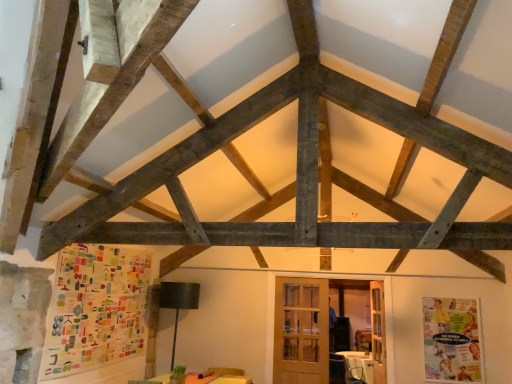
Image resolution: width=512 pixels, height=384 pixels. Describe the element at coordinates (178, 303) in the screenshot. I see `black fabric lamp at lower left` at that location.

I want to click on black fabric lamp at lower left, so click(x=178, y=303).

What is the approximate height of black fabric lamp at lower left?

1.26 meters.

Find the location of a particular element. The height and width of the screenshot is (384, 512). black fabric lamp at lower left is located at coordinates (178, 303).